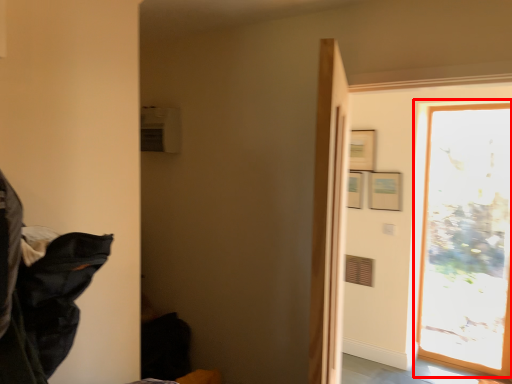
Question: From the image's perspective, where is window (annotated by the red box) located in relation to laundry in the image?

Choices:
 (A) above
 (B) below

Answer: (B)